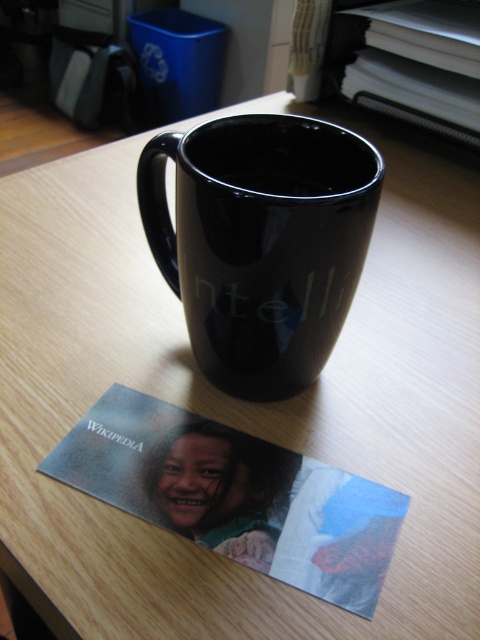
You are organizing a small desk space and need to place both the glossy ceramic mug at center and the glossy paper postcard at lower center into a drawer. The drawer has a height limit of 10 cm. Can you determine if both items will fit vertically without bending or folding the postcard?

The glossy ceramic mug at center is larger in size than the glossy paper postcard at lower center. However, without specific height measurements for each item, it is impossible to confirm if they will fit within the 10 cm height limit of the drawer. Additional information about their individual heights is required to make an accurate assessment.

You are looking at the scene and want to determine which of the two points, point (215, 372) or point (207, 531), is closer to you. Based on the description, which point is nearer?

Point (215, 372) is further to the viewer than point (207, 531). Wait, but the question asks which is closer to you. So if point A is further to the viewer than point B, that means point B is closer to the viewer. Therefore, the answer is point (207, 531) is closer.

You are organizing your desk and want to place a small plant between the glossy ceramic mug at center and the glossy paper postcard at lower center. Based on their positions, where should you place the plant?

The glossy ceramic mug at center is located above the glossy paper postcard at lower center, so you should place the plant between them in the space below the mug and above the postcard.